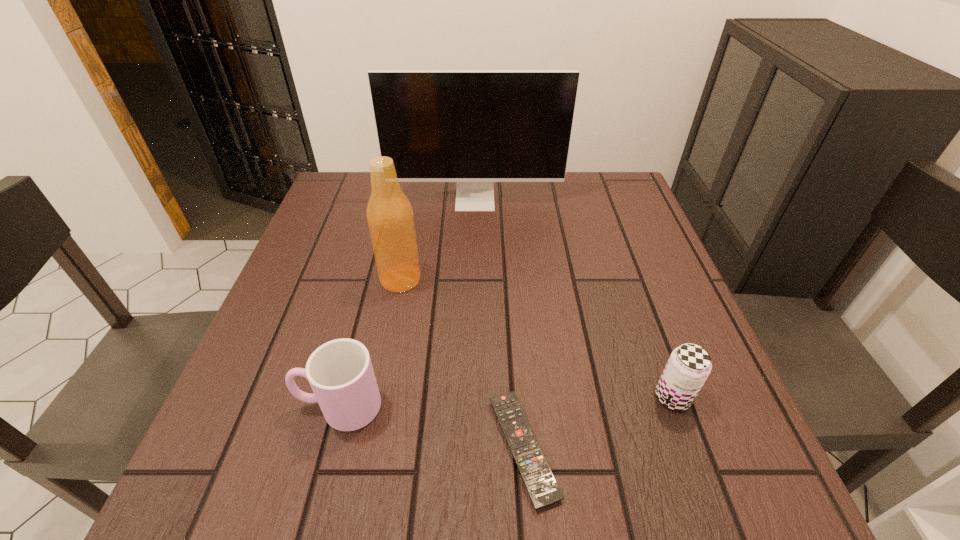
Identify the location of free spot located 0.370m on the left of the shortest object. (253, 448).

Locate an element on the screen. The image size is (960, 540). object at the far edge is located at coordinates (474, 127).

Locate an element on the screen. This screenshot has width=960, height=540. object present at the near edge is located at coordinates click(x=536, y=473).

The width and height of the screenshot is (960, 540). Identify the location of object located at the left edge. (340, 372).

This screenshot has width=960, height=540. Identify the location of object situated at the right edge. tap(689, 365).

The height and width of the screenshot is (540, 960). In the image, there is a desktop. What are the coordinates of `vacant region at the far edge` in the screenshot? It's located at (516, 194).

Image resolution: width=960 pixels, height=540 pixels. I want to click on free space at the near edge of the desktop, so click(x=391, y=475).

Locate an element on the screen. The height and width of the screenshot is (540, 960). blank area at the left edge is located at coordinates (319, 221).

Locate an element on the screen. This screenshot has height=540, width=960. vacant space at the far left corner of the desktop is located at coordinates (353, 212).

In the image, there is a desktop. Find the location of `vacant space at the far right corner`. vacant space at the far right corner is located at coordinates (588, 202).